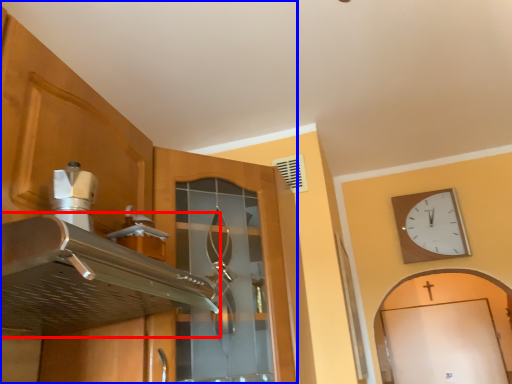
Question: Which object appears closest to the camera in this image, exhaust hood (highlighted by a red box) or cabinetry (highlighted by a blue box)?

Choices:
 (A) exhaust hood
 (B) cabinetry

Answer: (A)